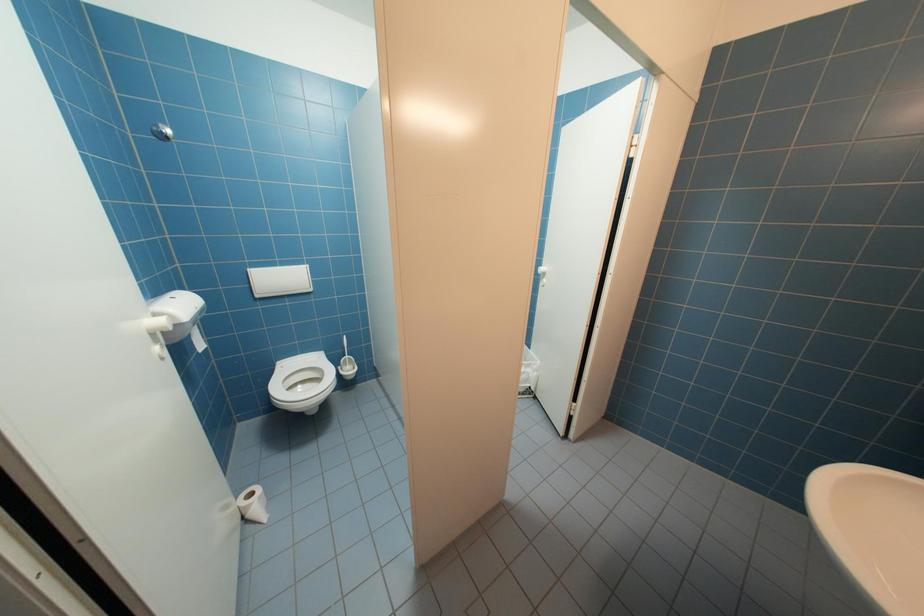
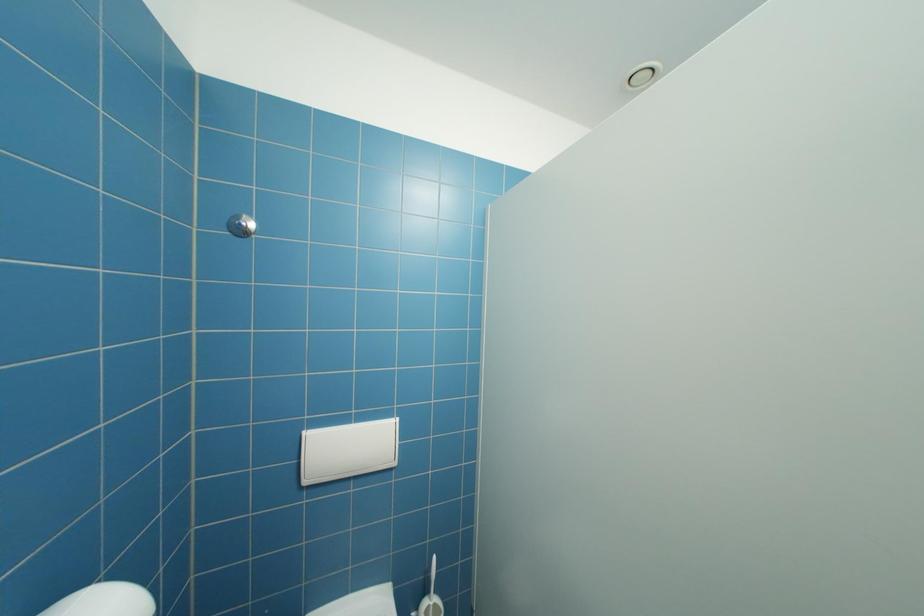
Which direction would the cameraman need to move to produce the second image?

The cameraman walked toward left, forward.